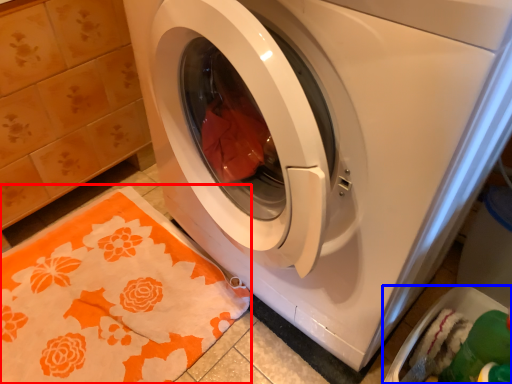
Question: Which object appears farthest to the camera in this image, blanket (highlighted by a red box) or dish washer (highlighted by a blue box)?

Choices:
 (A) blanket
 (B) dish washer

Answer: (A)